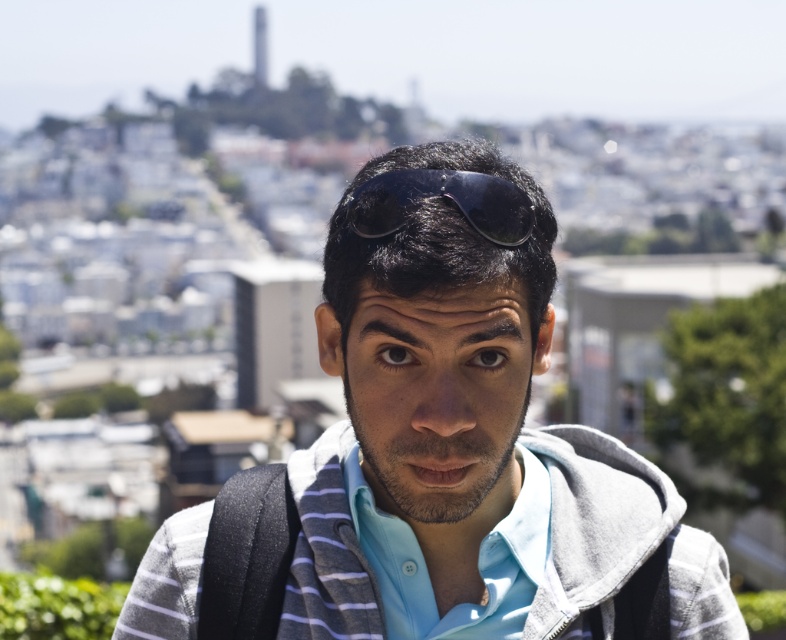
Is gray cotton hoodie at center positioned in front of light blue cotton shirt at center?

Yes.

Can you confirm if gray cotton hoodie at center is shorter than light blue cotton shirt at center?

Incorrect, gray cotton hoodie at center's height does not fall short of light blue cotton shirt at center's.

Does point (302, 624) come behind point (380, 593)?

No, it is not.

Identify the location of gray cotton hoodie at center. (465, 429).

This screenshot has height=640, width=786. In order to click on gray fleece sweatshirt at center in this screenshot , I will do `click(594, 520)`.

Does point (578, 531) come closer to viewer compared to point (436, 192)?

No, (578, 531) is further to viewer.

The height and width of the screenshot is (640, 786). In order to click on gray fleece sweatshirt at center in this screenshot , I will do `click(594, 520)`.

Locate an element on the screen. gray fleece sweatshirt at center is located at coordinates (594, 520).

Who is taller, gray cotton hoodie at center or gray fleece sweatshirt at center?

Standing taller between the two is gray cotton hoodie at center.

Can you confirm if gray cotton hoodie at center is wider than gray fleece sweatshirt at center?

Correct, the width of gray cotton hoodie at center exceeds that of gray fleece sweatshirt at center.

Find the location of `gray cotton hoodie at center`. gray cotton hoodie at center is located at coordinates (465, 429).